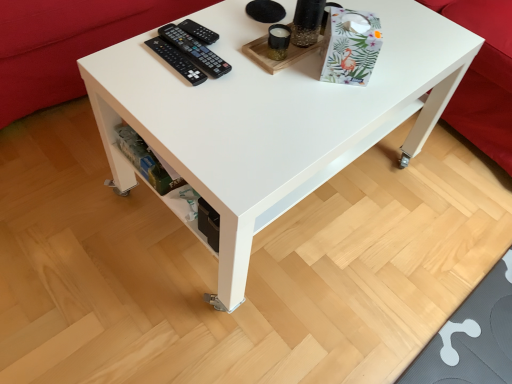
Question: Does red fabric couch at lower left, the 2th couch viewed from the right, have a greater height compared to red fabric couch at upper right, acting as the 2th couch starting from the left?

Choices:
 (A) no
 (B) yes

Answer: (A)

Question: From the image's perspective, does red fabric couch at lower left, the 2th couch viewed from the right, appear lower than red fabric couch at upper right, acting as the 2th couch starting from the left?

Choices:
 (A) yes
 (B) no

Answer: (B)

Question: Is red fabric couch at lower left, the 2th couch viewed from the right, bigger than red fabric couch at upper right, acting as the 2th couch starting from the left?

Choices:
 (A) no
 (B) yes

Answer: (B)

Question: Can we say red fabric couch at lower left, acting as the first couch starting from the left, lies outside red fabric couch at upper right, the 1th couch viewed from the right?

Choices:
 (A) yes
 (B) no

Answer: (A)

Question: Is red fabric couch at lower left, the 2th couch viewed from the right, shorter than red fabric couch at upper right, acting as the 2th couch starting from the left?

Choices:
 (A) yes
 (B) no

Answer: (A)

Question: Is red fabric couch at lower left, acting as the first couch starting from the left, facing away from red fabric couch at upper right, the 1th couch viewed from the right?

Choices:
 (A) no
 (B) yes

Answer: (A)

Question: Is red fabric couch at upper right, acting as the 2th couch starting from the left, shorter than white glossy table at center?

Choices:
 (A) yes
 (B) no

Answer: (B)

Question: Can white glossy table at center be found inside red fabric couch at upper right, acting as the 2th couch starting from the left?

Choices:
 (A) no
 (B) yes

Answer: (A)

Question: Can you confirm if red fabric couch at upper right, the 1th couch viewed from the right, is thinner than white glossy table at center?

Choices:
 (A) yes
 (B) no

Answer: (B)

Question: Is red fabric couch at upper right, acting as the 2th couch starting from the left, positioned in front of white glossy table at center?

Choices:
 (A) yes
 (B) no

Answer: (B)

Question: From a real-world perspective, is red fabric couch at upper right, acting as the 2th couch starting from the left, located higher than white glossy table at center?

Choices:
 (A) yes
 (B) no

Answer: (B)

Question: Are red fabric couch at upper right, acting as the 2th couch starting from the left, and white glossy table at center beside each other?

Choices:
 (A) no
 (B) yes

Answer: (A)

Question: Is black plastic remote at upper center, which ranks as the second control in bottom-to-top order, oriented away from white glossy table at center?

Choices:
 (A) no
 (B) yes

Answer: (B)